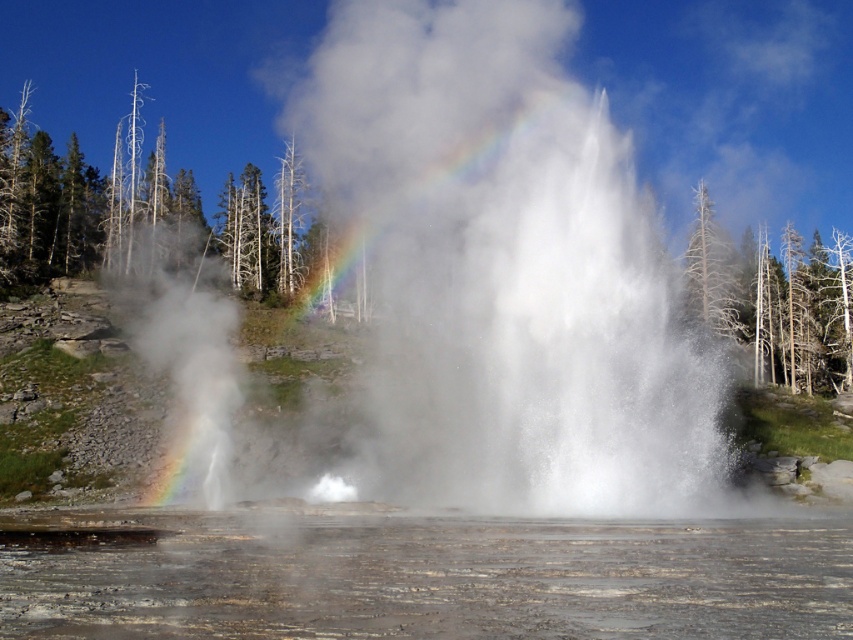
Consider the image. You are a geologist analyzing the geyser eruption. Based on the image, what is the exact 2D coordinate of the white vapor at center?

The exact 2D coordinate of the white vapor at center is at point (x=477, y=289).

You are a geologist observing the geyser eruption. You notice the white vapor at center and the translucent gray water at lower center. Which object is located above the other?

The white vapor at center is positioned over the translucent gray water at lower center, so it is above it.

In the scene shown: You are a photographer trying to capture the geyser eruption. You notice the white vapor at center and the translucent gray water at lower center. Which object would you focus on to capture the widest part of the geyser?

The white vapor at center has a larger width than the translucent gray water at lower center, so focusing on the white vapor at center would capture the widest part of the geyser.